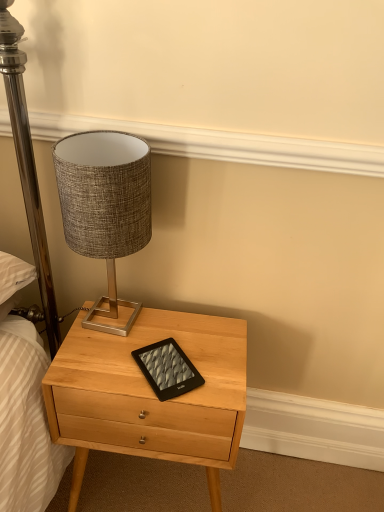
Image resolution: width=384 pixels, height=512 pixels. What do you see at coordinates (150, 395) in the screenshot? I see `light wood nightstand at center` at bounding box center [150, 395].

Measure the distance between textured fabric lampshade at upper left and camera.

A distance of 32.20 inches exists between textured fabric lampshade at upper left and camera.

What do you see at coordinates (105, 207) in the screenshot? The width and height of the screenshot is (384, 512). I see `textured fabric lampshade at upper left` at bounding box center [105, 207].

Identify the location of light wood nightstand at center. (150, 395).

Based on the photo, is black matte tablet at center completely or partially inside light wood nightstand at center?

Absolutely, black matte tablet at center is inside light wood nightstand at center.

Does point (183, 316) come closer to viewer compared to point (150, 370)?

No, it is behind (150, 370).

Is light wood nightstand at center far from black matte tablet at center?

light wood nightstand at center is actually quite close to black matte tablet at center.

Based on the photo, from a real-world perspective, is light wood nightstand at center positioned over black matte tablet at center based on gravity?

No, from a real-world perspective, light wood nightstand at center is not over black matte tablet at center

Between textured fabric lampshade at upper left and black matte tablet at center, which one has more height?

With more height is textured fabric lampshade at upper left.

Is textured fabric lampshade at upper left closer to camera compared to black matte tablet at center?

Yes, it is.

Is black matte tablet at center at the back of textured fabric lampshade at upper left?

No, textured fabric lampshade at upper left is not facing the opposite direction of black matte tablet at center.

From the image's perspective, is textured fabric lampshade at upper left located above or below black matte tablet at center?

From the image's perspective, textured fabric lampshade at upper left appears above black matte tablet at center.

From the picture: Is black matte tablet at center located outside textured fabric lampshade at upper left?

Yes, black matte tablet at center is not within textured fabric lampshade at upper left.

Can you confirm if black matte tablet at center is shorter than textured fabric lampshade at upper left?

Indeed, black matte tablet at center has a lesser height compared to textured fabric lampshade at upper left.

Which of these two, black matte tablet at center or textured fabric lampshade at upper left, is bigger?

textured fabric lampshade at upper left is bigger.

Where is `tablet computer on the right of textured fabric lampshade at upper left`? tablet computer on the right of textured fabric lampshade at upper left is located at coordinates (167, 369).

Which is in front, point (145, 346) or point (104, 450)?

The point (145, 346) is more forward.

Looking at the image, does black matte tablet at center seem bigger or smaller compared to light wood nightstand at center?

Considering their sizes, black matte tablet at center takes up less space than light wood nightstand at center.

Is black matte tablet at center positioned far away from light wood nightstand at center?

No, black matte tablet at center is not far away from light wood nightstand at center.

Could you tell me if black matte tablet at center is turned towards light wood nightstand at center?

Yes, black matte tablet at center is turned towards light wood nightstand at center.

Is light wood nightstand at center at the left side of textured fabric lampshade at upper left?

No.

Does light wood nightstand at center turn towards textured fabric lampshade at upper left?

No, light wood nightstand at center is not oriented towards textured fabric lampshade at upper left.

Considering the sizes of objects light wood nightstand at center and textured fabric lampshade at upper left in the image provided, who is thinner, light wood nightstand at center or textured fabric lampshade at upper left?

textured fabric lampshade at upper left.

From a real-world perspective, does light wood nightstand at center sit lower than textured fabric lampshade at upper left?

Indeed, from a real-world perspective, light wood nightstand at center is positioned beneath textured fabric lampshade at upper left.

What's the angular difference between textured fabric lampshade at upper left and light wood nightstand at center's facing directions?

There is a 5.96-degree angle between the facing directions of textured fabric lampshade at upper left and light wood nightstand at center.

In the image, there is a textured fabric lampshade at upper left. Where is `nightstand below it (from a real-world perspective)`? nightstand below it (from a real-world perspective) is located at coordinates (150, 395).

Based on the photo, who is taller, textured fabric lampshade at upper left or light wood nightstand at center?

Standing taller between the two is light wood nightstand at center.

I want to click on nightstand on the left of the black matte tablet at center, so click(x=150, y=395).

Find the location of a particular element. The height and width of the screenshot is (512, 384). tablet computer that is below the textured fabric lampshade at upper left (from the image's perspective) is located at coordinates (167, 369).

Looking at the image, which one is located closer to light wood nightstand at center, black matte tablet at center or textured fabric lampshade at upper left?

black matte tablet at center is positioned closer to the anchor light wood nightstand at center.

Looking at the image, which one is located closer to textured fabric lampshade at upper left, light wood nightstand at center or black matte tablet at center?

black matte tablet at center is positioned closer to the anchor textured fabric lampshade at upper left.

Estimate the real-world distances between objects in this image. Which object is closer to textured fabric lampshade at upper left, black matte tablet at center or light wood nightstand at center?

black matte tablet at center.

Looking at the image, which one is located further to black matte tablet at center, light wood nightstand at center or textured fabric lampshade at upper left?

The object further to black matte tablet at center is textured fabric lampshade at upper left.

Estimate the real-world distances between objects in this image. Which object is closer to black matte tablet at center, textured fabric lampshade at upper left or light wood nightstand at center?

light wood nightstand at center.

Looking at the image, which one is located further to light wood nightstand at center, textured fabric lampshade at upper left or black matte tablet at center?

textured fabric lampshade at upper left lies further to light wood nightstand at center than the other object.

Identify the location of tablet computer between textured fabric lampshade at upper left and light wood nightstand at center from top to bottom. (167, 369).